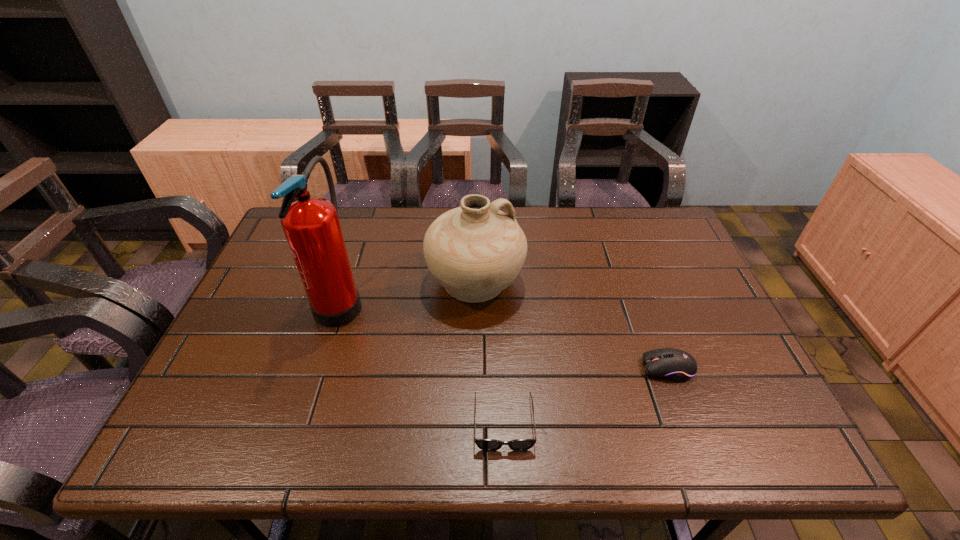
Where is `unoccupied area between the rightmost object and the fire extinguisher`? This screenshot has height=540, width=960. unoccupied area between the rightmost object and the fire extinguisher is located at coordinates (504, 334).

Where is `vacant area that lies between the computer mouse and the second tallest object`? This screenshot has height=540, width=960. vacant area that lies between the computer mouse and the second tallest object is located at coordinates (572, 325).

The height and width of the screenshot is (540, 960). In order to click on vacant space that's between the pottery and the sunglasses in this screenshot , I will do `click(490, 352)`.

Locate an element on the screen. The width and height of the screenshot is (960, 540). vacant point located between the fire extinguisher and the pottery is located at coordinates (408, 290).

I want to click on free space that is in between the sunglasses and the third farthest object, so click(x=586, y=395).

Locate an element on the screen. vacant area between the pottery and the sunglasses is located at coordinates (490, 352).

You are a GUI agent. You are given a task and a screenshot of the screen. Output one action in this format:
    pyautogui.click(x=<x>, y=<y>)
    Task: Click on the vacant area between the rightmost object and the sunglasses
    
    Given the screenshot: What is the action you would take?
    (586, 395)

Where is `free point between the pottery and the third farthest object`? The width and height of the screenshot is (960, 540). free point between the pottery and the third farthest object is located at coordinates (572, 325).

This screenshot has height=540, width=960. Identify the location of vacant area that lies between the nearest object and the second tallest object. (490, 352).

Identify which object is the nearest to the second tallest object. Please provide its 2D coordinates. Your answer should be formatted as a tuple, i.e. [(x, y)], where the tuple contains the x and y coordinates of a point satisfying the conditions above.

[(311, 225)]